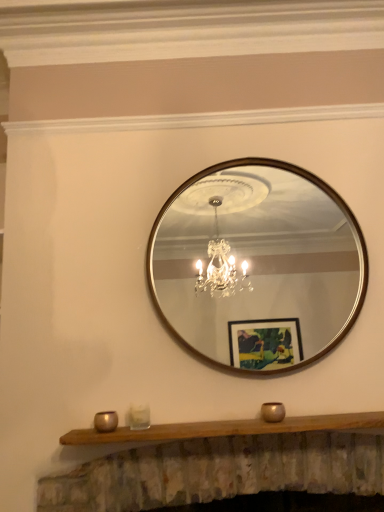
Where is `spots to the right of gold metallic candle holder at lower center, marked as the third candle holder in a left-to-right arrangement`? This screenshot has height=512, width=384. spots to the right of gold metallic candle holder at lower center, marked as the third candle holder in a left-to-right arrangement is located at coordinates point(315,420).